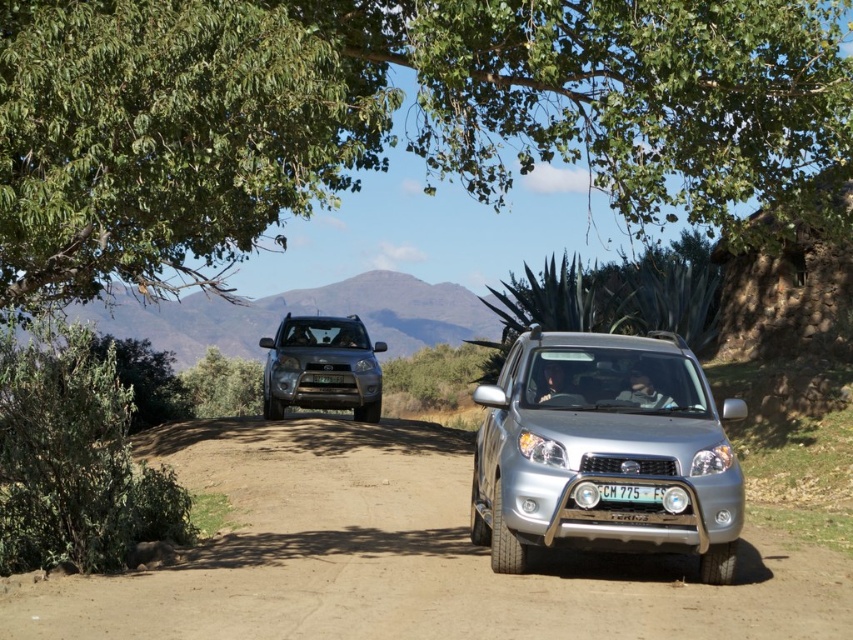
Question: In this image, where is green leafy tree at upper left located relative to green matte license plate at center?

Choices:
 (A) above
 (B) below

Answer: (A)

Question: In this image, where is silver metallic suv at center located relative to satin silver suv at center?

Choices:
 (A) right
 (B) left

Answer: (A)

Question: Which object is closer to the camera taking this photo?

Choices:
 (A) green matte license plate at center
 (B) white plastic license plate at center

Answer: (B)

Question: Among these points, which one is nearest to the camera?

Choices:
 (A) (622, 490)
 (B) (115, 225)
 (C) (328, 380)
 (D) (602, 621)

Answer: (D)

Question: Can you confirm if white plastic license plate at center is positioned to the right of green matte license plate at center?

Choices:
 (A) no
 (B) yes

Answer: (B)

Question: Which object is positioned closest to the silver metallic suv at center?

Choices:
 (A) green leafy tree at upper center
 (B) green matte license plate at center
 (C) green leafy tree at upper left
 (D) satin silver suv at center

Answer: (C)